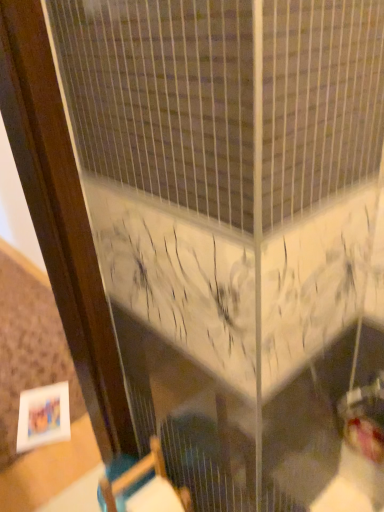
Question: From a real-world perspective, is white matte picture frame at lower left positioned over wooden chair at lower center based on gravity?

Choices:
 (A) yes
 (B) no

Answer: (B)

Question: Is there a large distance between white matte picture frame at lower left and wooden chair at lower center?

Choices:
 (A) yes
 (B) no

Answer: (B)

Question: From the image's perspective, is white matte picture frame at lower left beneath wooden chair at lower center?

Choices:
 (A) yes
 (B) no

Answer: (A)

Question: Considering the relative positions of white matte picture frame at lower left and wooden chair at lower center in the image provided, is white matte picture frame at lower left to the left of wooden chair at lower center from the viewer's perspective?

Choices:
 (A) no
 (B) yes

Answer: (B)

Question: Is white matte picture frame at lower left wider than wooden chair at lower center?

Choices:
 (A) yes
 (B) no

Answer: (A)

Question: Can you confirm if white matte picture frame at lower left is positioned to the right of wooden chair at lower center?

Choices:
 (A) yes
 (B) no

Answer: (B)

Question: Is wooden chair at lower center wider than white matte picture frame at lower left?

Choices:
 (A) yes
 (B) no

Answer: (B)

Question: Are wooden chair at lower center and white matte picture frame at lower left making contact?

Choices:
 (A) yes
 (B) no

Answer: (B)

Question: Is wooden chair at lower center positioned far away from white matte picture frame at lower left?

Choices:
 (A) yes
 (B) no

Answer: (B)

Question: Is wooden chair at lower center at the right side of white matte picture frame at lower left?

Choices:
 (A) no
 (B) yes

Answer: (B)

Question: From a real-world perspective, is wooden chair at lower center physically below white matte picture frame at lower left?

Choices:
 (A) no
 (B) yes

Answer: (A)

Question: Is wooden chair at lower center taller than white matte picture frame at lower left?

Choices:
 (A) yes
 (B) no

Answer: (A)

Question: Is white matte picture frame at lower left bigger or smaller than wooden chair at lower center?

Choices:
 (A) small
 (B) big

Answer: (A)